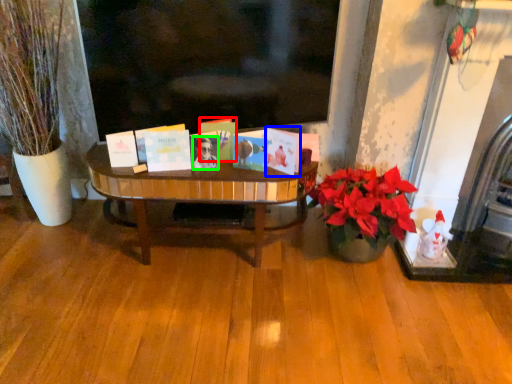
Question: Estimate the real-world distances between objects in this image. Which object is farther from book (highlighted by a red box), book (highlighted by a blue box) or person (highlighted by a green box)?

Choices:
 (A) book
 (B) person

Answer: (A)